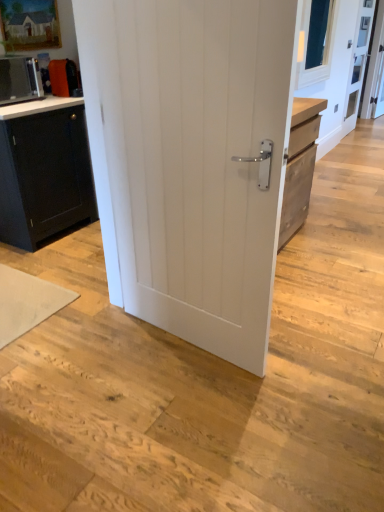
Question: Does white glossy countertop at upper left lie behind white matte yoga mat at lower left?

Choices:
 (A) no
 (B) yes

Answer: (B)

Question: Can you confirm if white glossy countertop at upper left is bigger than white matte yoga mat at lower left?

Choices:
 (A) no
 (B) yes

Answer: (B)

Question: Is white glossy countertop at upper left surrounding white matte yoga mat at lower left?

Choices:
 (A) no
 (B) yes

Answer: (A)

Question: Can you confirm if white glossy countertop at upper left is positioned to the right of white matte yoga mat at lower left?

Choices:
 (A) yes
 (B) no

Answer: (B)

Question: Is white glossy countertop at upper left positioned with its back to white matte yoga mat at lower left?

Choices:
 (A) no
 (B) yes

Answer: (A)

Question: Is white glossy countertop at upper left shorter than white matte yoga mat at lower left?

Choices:
 (A) yes
 (B) no

Answer: (B)

Question: Is white painted wood door at center at the right side of white matte yoga mat at lower left?

Choices:
 (A) no
 (B) yes

Answer: (B)

Question: Is white painted wood door at center closer to camera compared to white matte yoga mat at lower left?

Choices:
 (A) no
 (B) yes

Answer: (B)

Question: Considering the relative positions of white painted wood door at center and white matte yoga mat at lower left in the image provided, is white painted wood door at center behind white matte yoga mat at lower left?

Choices:
 (A) yes
 (B) no

Answer: (B)

Question: Is white painted wood door at center thinner than white matte yoga mat at lower left?

Choices:
 (A) no
 (B) yes

Answer: (B)

Question: Is white painted wood door at center surrounding white matte yoga mat at lower left?

Choices:
 (A) no
 (B) yes

Answer: (A)

Question: Can you confirm if white painted wood door at center is shorter than white matte yoga mat at lower left?

Choices:
 (A) no
 (B) yes

Answer: (A)

Question: Considering the relative sizes of white matte yoga mat at lower left and white glossy countertop at upper left in the image provided, is white matte yoga mat at lower left bigger than white glossy countertop at upper left?

Choices:
 (A) yes
 (B) no

Answer: (B)